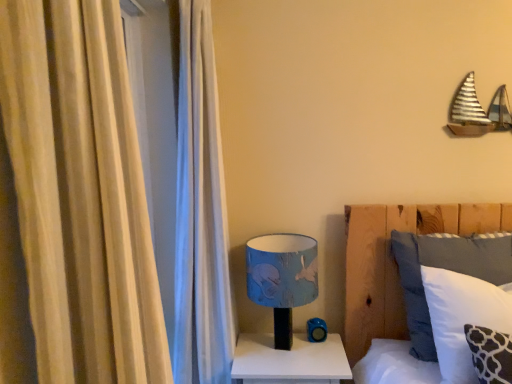
Image resolution: width=512 pixels, height=384 pixels. In order to click on empty space that is ontop of white glossy nightstand at lower center (from a real-world perspective) in this screenshot , I will do `click(291, 355)`.